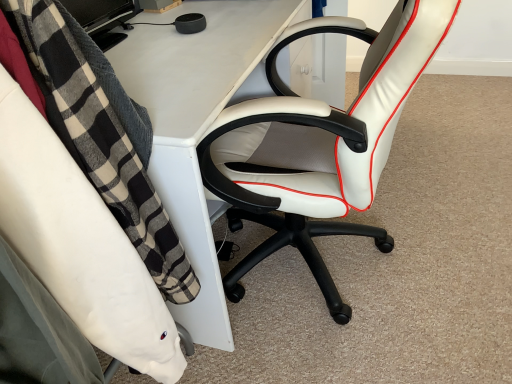
Question: Considering the positions of white leather office chair at right, placed as the second chair when sorted from right to left, and white leather office chair at center, which is the second chair in left-to-right order, in the image, is white leather office chair at right, placed as the second chair when sorted from right to left, wider or thinner than white leather office chair at center, which is the second chair in left-to-right order,?

Choices:
 (A) thin
 (B) wide

Answer: (A)

Question: From the image's perspective, is white leather office chair at right, placed as the second chair when sorted from right to left, located above or below white leather office chair at center, which is the 1th chair in right-to-left order?

Choices:
 (A) below
 (B) above

Answer: (A)

Question: Estimate the real-world distances between objects in this image. Which object is farther from the white leather office chair at right, placed as the second chair when sorted from right to left?

Choices:
 (A) white plastic desk at center
 (B) white leather office chair at center, which is the second chair in left-to-right order

Answer: (B)

Question: Which is farther from the white leather office chair at center, which is the 1th chair in right-to-left order?

Choices:
 (A) white plastic desk at center
 (B) white leather office chair at right, the first chair positioned from the left

Answer: (B)